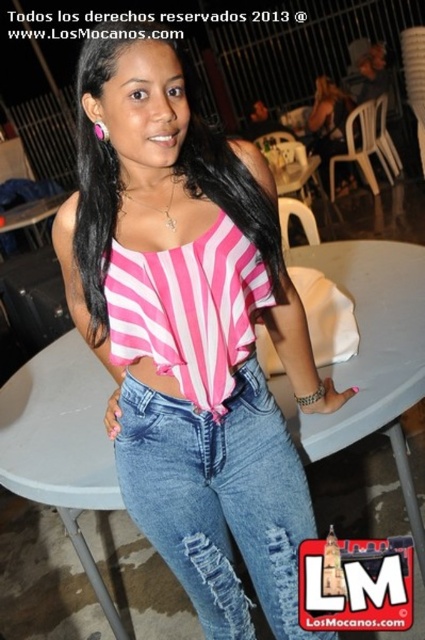
From the picture: Can you confirm if ripped denim jeans at center is thinner than denim jeans at center?

In fact, ripped denim jeans at center might be wider than denim jeans at center.

Is ripped denim jeans at center taller than denim jeans at center?

Yes.

Who is more distant from viewer, (269, 547) or (243, 365)?

Point (269, 547)

You are a GUI agent. You are given a task and a screenshot of the screen. Output one action in this format:
    pyautogui.click(x=<x>, y=<y>)
    Task: Click on the ripped denim jeans at center
    Image resolution: width=425 pixels, height=640 pixels.
    Given the screenshot: What is the action you would take?
    pyautogui.click(x=218, y=499)

I want to click on ripped denim jeans at center, so click(x=218, y=499).

Who is more distant from viewer, (272, 449) or (104, 276)?

Positioned behind is point (272, 449).

Is point (220, 435) positioned in front of point (209, 147)?

That is False.

At what (x,y) coordinates should I click in order to perform the action: click on ripped denim jeans at center. Please return your answer as a coordinate pair (x, y). The height and width of the screenshot is (640, 425). Looking at the image, I should click on (218, 499).

Between pink striped fabric top at center and denim jeans at center, which one has less height?

denim jeans at center is shorter.

Is point (303, 516) behind point (261, 387)?

Yes, point (303, 516) is farther from viewer.

Where is `pink striped fabric top at center`? The height and width of the screenshot is (640, 425). pink striped fabric top at center is located at coordinates (189, 333).